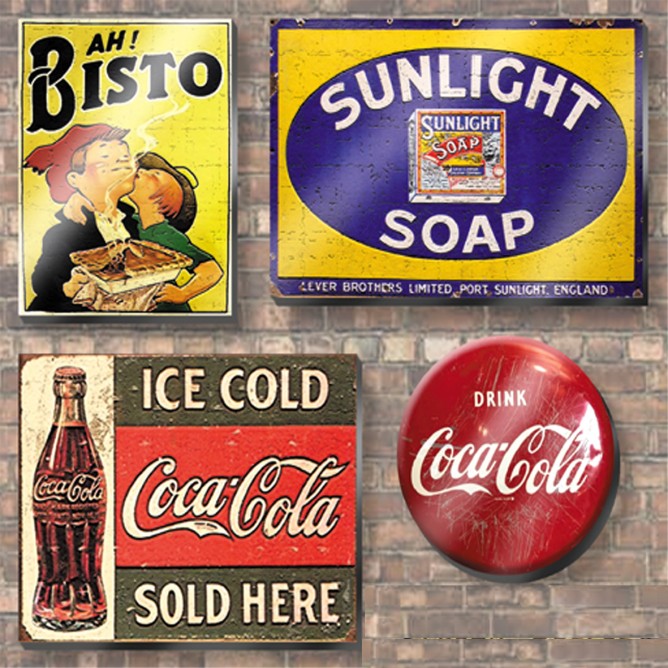
The width and height of the screenshot is (668, 668). I want to click on wall decor, so click(257, 492), click(453, 437), click(485, 146), click(85, 180).